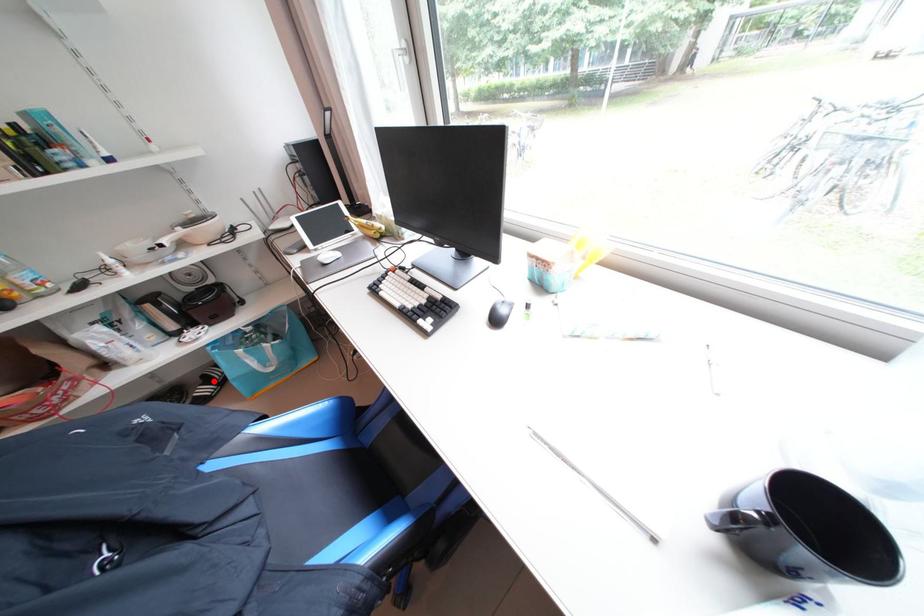
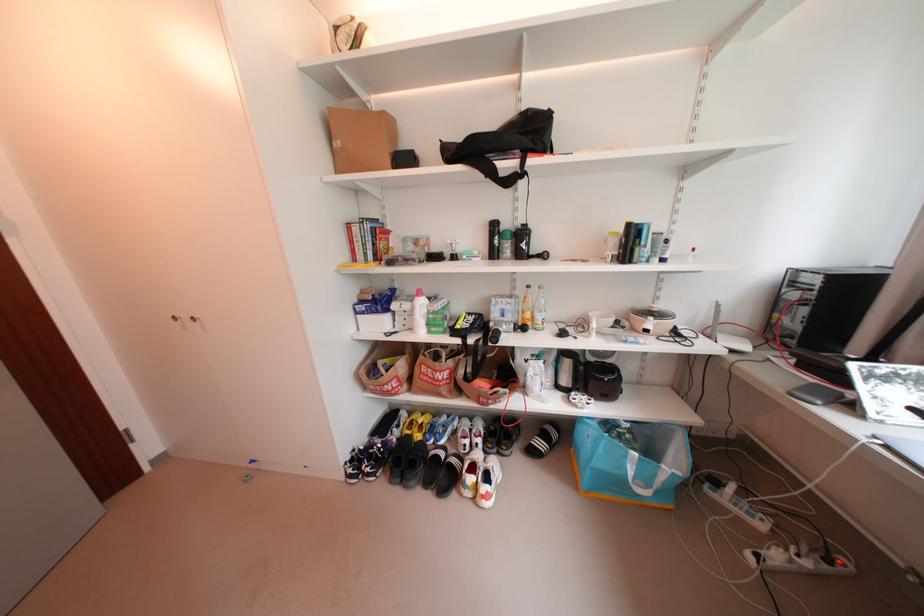
In the second image, find the point that corresponds to the highlighted location in the first image.

(553, 437)